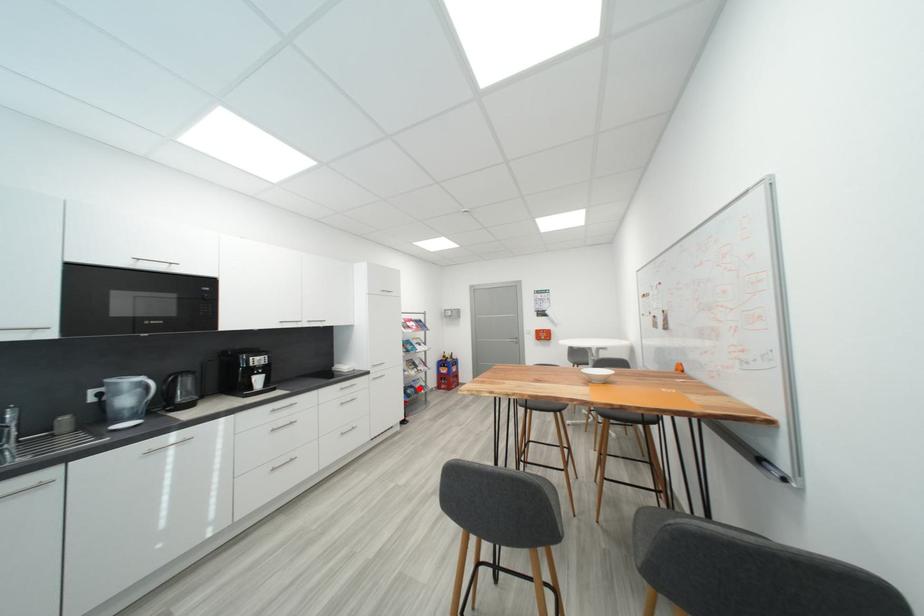
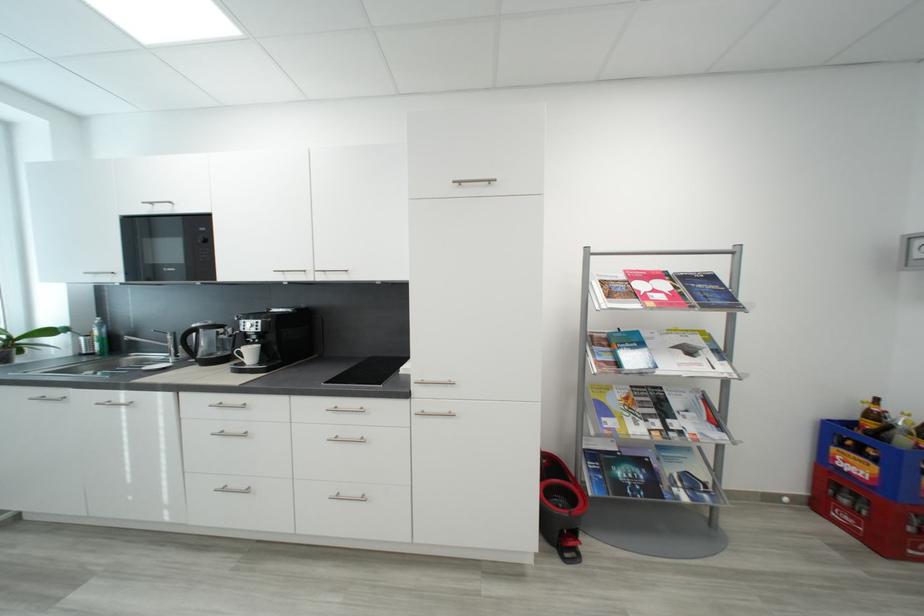
In the second image, find the point that corresponds to the highlighted location in the first image.

(650, 464)